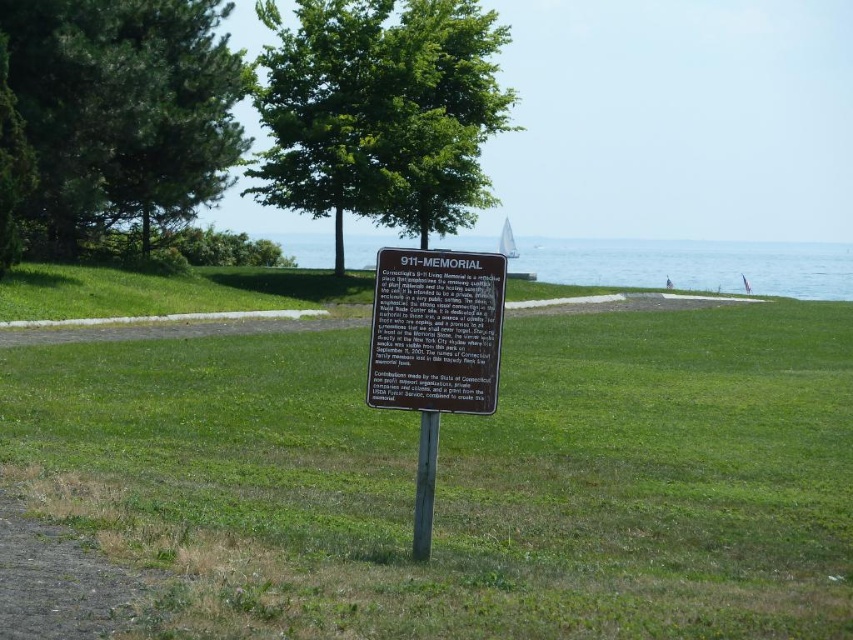
You are standing at the 911 MEMORIAL signpost and want to see both the green textured pine tree at upper left and the blue water at center. Which object is higher in your field of view?

The green textured pine tree at upper left is higher in your field of view than the blue water at center because it is positioned above it.

You are standing at point (740,282) and want to walk towards the brown signpost with the plaque titled 911 MEMORIAL. Is the point (25,109) between you and the signpost?

Yes, point (25,109) is between you and the signpost because it is in front of point (740,282), which is your current position.